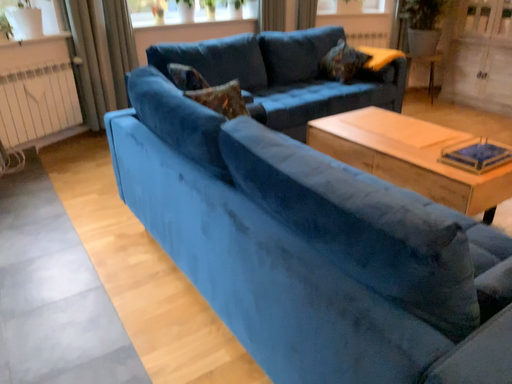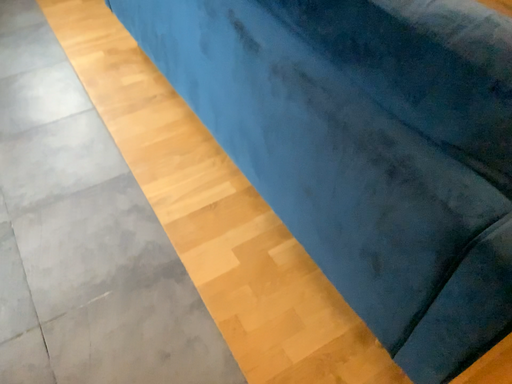
Question: How did the camera likely rotate when shooting the video?

Choices:
 (A) rotated upward
 (B) rotated downward

Answer: (B)